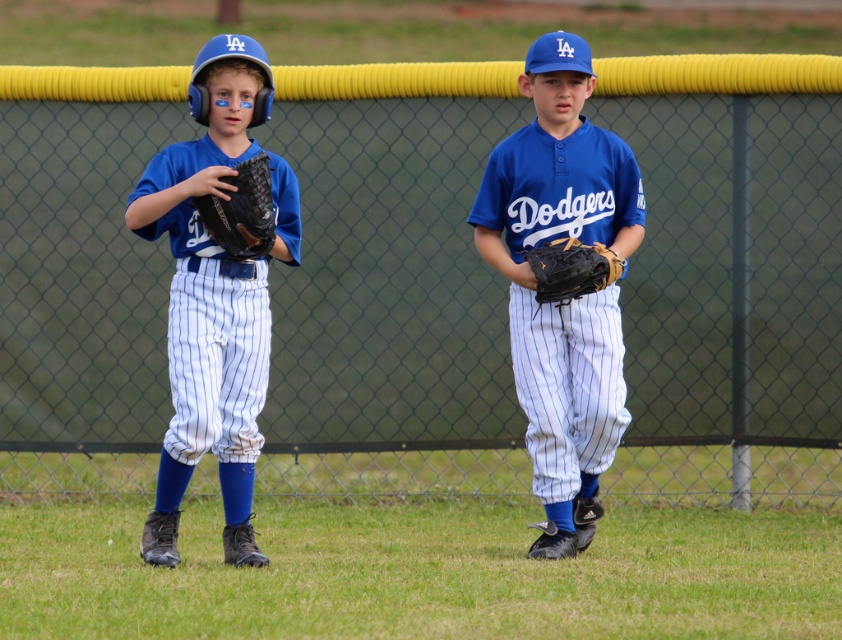
Question: Which point is closer to the camera?

Choices:
 (A) black leather glove at left
 (B) matte blue baseball glove at left
 (C) black leather glove at center

Answer: (B)

Question: Which point is closer to the camera?

Choices:
 (A) matte blue baseball glove at left
 (B) matte blue jersey at center
 (C) black leather glove at center

Answer: (A)

Question: Considering the relative positions of matte blue baseball glove at left and black leather glove at left in the image provided, where is matte blue baseball glove at left located with respect to black leather glove at left?

Choices:
 (A) left
 (B) right

Answer: (A)

Question: Can you confirm if matte blue jersey at center is positioned below black leather glove at left?

Choices:
 (A) no
 (B) yes

Answer: (B)

Question: Considering the real-world distances, which object is farthest from the yellow rubberized fence at center?

Choices:
 (A) black leather glove at left
 (B) matte blue baseball glove at left

Answer: (A)

Question: Does matte blue jersey at center have a larger size compared to black leather glove at center?

Choices:
 (A) yes
 (B) no

Answer: (A)